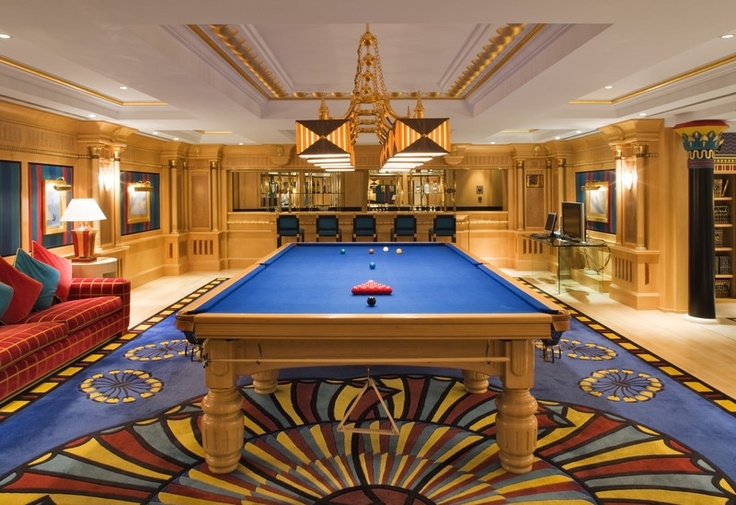
The image size is (736, 505). Find the location of `table legs`. table legs is located at coordinates (226, 413), (271, 379), (480, 387), (526, 410).